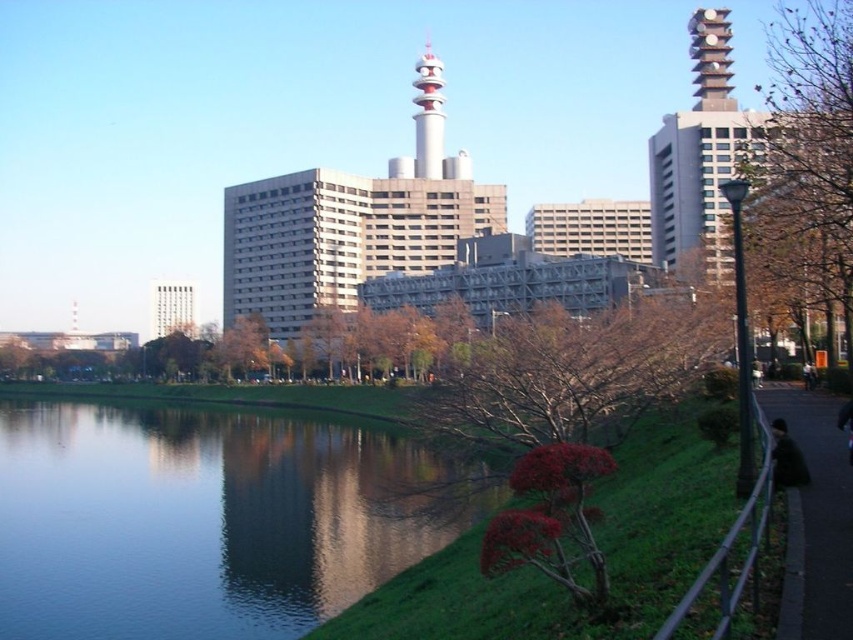
Based on the photo, is smooth concrete tower at center to the left of dark fabric jacket at lower right from the viewer's perspective?

Yes, smooth concrete tower at center is to the left of dark fabric jacket at lower right.

Which is behind, point (424, 156) or point (786, 436)?

Point (424, 156)

At what (x,y) coordinates should I click in order to perform the action: click on smooth concrete tower at center. Please return your answer as a coordinate pair (x, y). Looking at the image, I should click on (351, 225).

Consider the image. Who is higher up, red textured bush at center or black fabric at lower right?

red textured bush at center is above.

Locate an element on the screen. This screenshot has width=853, height=640. red textured bush at center is located at coordinates (558, 352).

Identify the location of red textured bush at center. Image resolution: width=853 pixels, height=640 pixels. (558, 352).

Does red textured bush at center have a greater height compared to dark fabric jacket at lower right?

Yes.

You are a GUI agent. You are given a task and a screenshot of the screen. Output one action in this format:
    pyautogui.click(x=<x>, y=<y>)
    Task: Click on the red textured bush at center
    
    Given the screenshot: What is the action you would take?
    pyautogui.click(x=558, y=352)

Which is in front, point (634, 282) or point (780, 422)?

Point (780, 422)

Find the location of a particular element. The width and height of the screenshot is (853, 640). red textured bush at center is located at coordinates (558, 352).